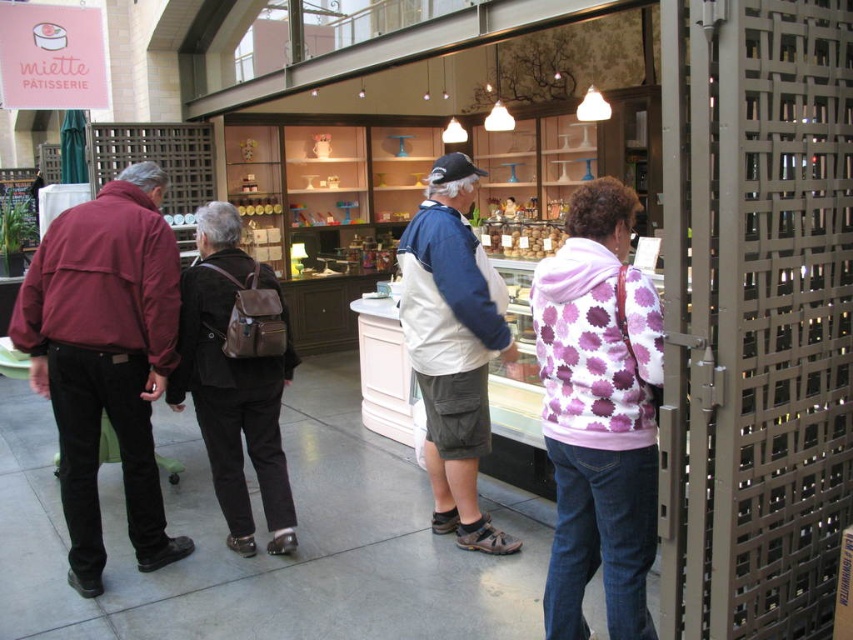
Question: Which point is closer to the camera taking this photo?

Choices:
 (A) (479, 428)
 (B) (144, 403)
 (C) (241, 344)

Answer: (B)

Question: Which point is closer to the camera?

Choices:
 (A) purple dotted hoodie at center
 (B) khaki cargo shorts at center
 (C) brown leather backpack at center

Answer: (A)

Question: Is purple dotted hoodie at center positioned in front of khaki cargo shorts at center?

Choices:
 (A) no
 (B) yes

Answer: (B)

Question: Does purple dotted hoodie at center have a lesser width compared to maroon fabric jacket at left?

Choices:
 (A) yes
 (B) no

Answer: (A)

Question: Can you confirm if maroon fabric jacket at left is bigger than khaki cargo shorts at center?

Choices:
 (A) yes
 (B) no

Answer: (A)

Question: Estimate the real-world distances between objects in this image. Which object is closer to the maroon fabric jacket at left?

Choices:
 (A) khaki cargo shorts at center
 (B) purple dotted hoodie at center
 (C) brown leather backpack at center

Answer: (C)